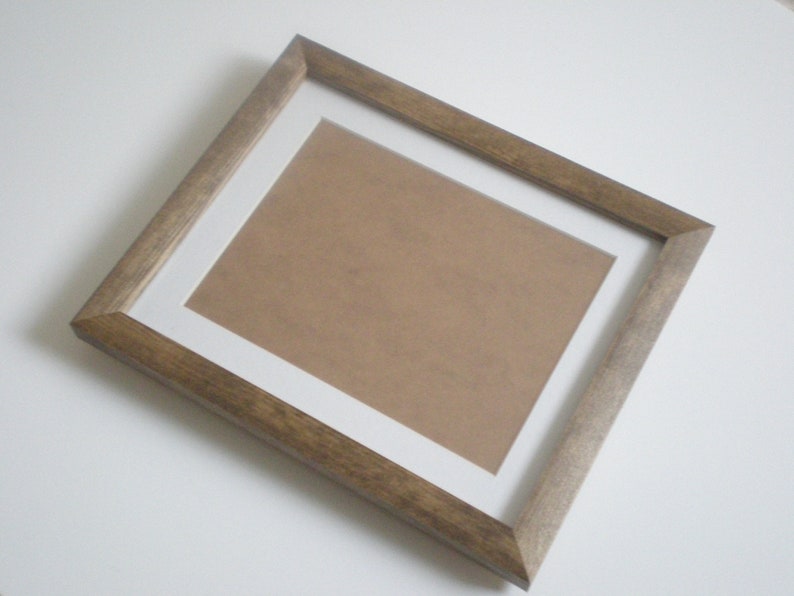
You are a GUI agent. You are given a task and a screenshot of the screen. Output one action in this format:
    pyautogui.click(x=<x>, y=<y>)
    Task: Click on the frame
    The height and width of the screenshot is (596, 794).
    Given the screenshot: What is the action you would take?
    pyautogui.click(x=627, y=377)